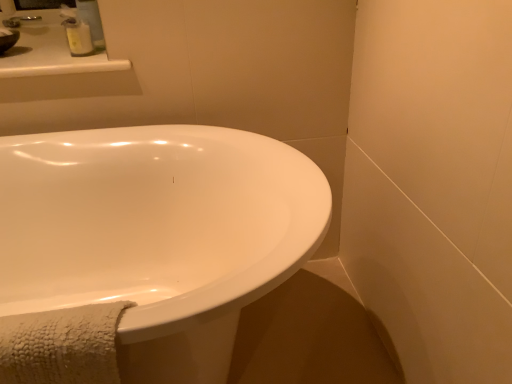
Measure the distance between white glossy bathtub at lower left and camera.

The depth of white glossy bathtub at lower left is 21.55 inches.

This screenshot has height=384, width=512. Describe the element at coordinates (78, 37) in the screenshot. I see `white plastic soap dispenser at upper left` at that location.

The image size is (512, 384). I want to click on matte white sink at upper left, so click(x=9, y=33).

From a real-world perspective, is white glossy bathtub at lower left positioned above or below white plastic soap dispenser at upper left?

Clearly, from a real-world perspective, white glossy bathtub at lower left is below white plastic soap dispenser at upper left.

From the image's perspective, is white glossy bathtub at lower left positioned above or below white plastic soap dispenser at upper left?

white glossy bathtub at lower left is below white plastic soap dispenser at upper left.

Which is more to the left, white glossy bathtub at lower left or white plastic soap dispenser at upper left?

From the viewer's perspective, white plastic soap dispenser at upper left appears more on the left side.

Is white plastic soap dispenser at upper left completely or partially inside white glossy bathtub at lower left?

No, white plastic soap dispenser at upper left is located outside of white glossy bathtub at lower left.

From the image's perspective, is white plastic soap dispenser at upper left below matte white sink at upper left?

Actually, white plastic soap dispenser at upper left appears above matte white sink at upper left in the image.

Would you say white plastic soap dispenser at upper left is outside matte white sink at upper left?

white plastic soap dispenser at upper left lies outside matte white sink at upper left's area.

Considering the sizes of objects white plastic soap dispenser at upper left and matte white sink at upper left in the image provided, who is thinner, white plastic soap dispenser at upper left or matte white sink at upper left?

Thinner between the two is white plastic soap dispenser at upper left.

From the picture: Who is shorter, white glossy bathtub at lower left or matte white sink at upper left?

matte white sink at upper left.

Is white glossy bathtub at lower left far away from matte white sink at upper left?

No.

From a real-world perspective, is white glossy bathtub at lower left on matte white sink at upper left?

Actually, white glossy bathtub at lower left is physically below matte white sink at upper left in the real world.

How far apart are white glossy bathtub at lower left and matte white sink at upper left?

The distance of white glossy bathtub at lower left from matte white sink at upper left is 79.81 centimeters.

From the image's perspective, which one is positioned higher, matte white sink at upper left or white glossy bathtub at lower left?

matte white sink at upper left appears higher in the image.

Could white glossy bathtub at lower left be considered to be inside matte white sink at upper left?

Actually, white glossy bathtub at lower left is outside matte white sink at upper left.

Is matte white sink at upper left at the right side of white glossy bathtub at lower left?

In fact, matte white sink at upper left is to the left of white glossy bathtub at lower left.

Considering the sizes of objects matte white sink at upper left and white glossy bathtub at lower left in the image provided, who is thinner, matte white sink at upper left or white glossy bathtub at lower left?

Thinner between the two is matte white sink at upper left.

Can you confirm if white plastic soap dispenser at upper left is smaller than white glossy bathtub at lower left?

Yes, white plastic soap dispenser at upper left is smaller than white glossy bathtub at lower left.

Where is `soap dispenser behind the white glossy bathtub at lower left`? Image resolution: width=512 pixels, height=384 pixels. soap dispenser behind the white glossy bathtub at lower left is located at coordinates (78, 37).

Is white glossy bathtub at lower left located within white plastic soap dispenser at upper left?

No, white glossy bathtub at lower left is not inside white plastic soap dispenser at upper left.

From a real-world perspective, is white plastic soap dispenser at upper left physically below white glossy bathtub at lower left?

Incorrect, from a real-world perspective, white plastic soap dispenser at upper left is higher than white glossy bathtub at lower left.

What's the angular difference between matte white sink at upper left and white plastic soap dispenser at upper left's facing directions?

matte white sink at upper left and white plastic soap dispenser at upper left are facing 6.94 degrees away from each other.

From the image's perspective, is matte white sink at upper left positioned above or below white plastic soap dispenser at upper left?

matte white sink at upper left is below white plastic soap dispenser at upper left.

Considering the points (17, 20) and (77, 52), which point is in front, point (17, 20) or point (77, 52)?

Positioned in front is point (77, 52).

Would you consider matte white sink at upper left to be distant from white plastic soap dispenser at upper left?

They are positioned close to each other.

You are a GUI agent. You are given a task and a screenshot of the screen. Output one action in this format:
    pyautogui.click(x=<x>, y=<y>)
    Task: Click on the bathtub in front of the white plastic soap dispenser at upper left
    The height and width of the screenshot is (384, 512).
    Given the screenshot: What is the action you would take?
    pyautogui.click(x=157, y=234)

This screenshot has height=384, width=512. I want to click on soap dispenser above the matte white sink at upper left (from the image's perspective), so click(78, 37).

Based on their spatial positions, is white plastic soap dispenser at upper left or white glossy bathtub at lower left closer to matte white sink at upper left?

Among the two, white plastic soap dispenser at upper left is located nearer to matte white sink at upper left.

From the image, which object appears to be farther from white plastic soap dispenser at upper left, white glossy bathtub at lower left or matte white sink at upper left?

white glossy bathtub at lower left lies further to white plastic soap dispenser at upper left than the other object.

Which object lies nearer to the anchor point white plastic soap dispenser at upper left, matte white sink at upper left or white glossy bathtub at lower left?

Among the two, matte white sink at upper left is located nearer to white plastic soap dispenser at upper left.

Based on their spatial positions, is white glossy bathtub at lower left or white plastic soap dispenser at upper left further from matte white sink at upper left?

The object further to matte white sink at upper left is white glossy bathtub at lower left.

Consider the image. Looking at the image, which one is located closer to white glossy bathtub at lower left, matte white sink at upper left or white plastic soap dispenser at upper left?

white plastic soap dispenser at upper left lies closer to white glossy bathtub at lower left than the other object.

When comparing their distances from white glossy bathtub at lower left, does white plastic soap dispenser at upper left or matte white sink at upper left seem further?

matte white sink at upper left is further to white glossy bathtub at lower left.

Locate an element on the screen. This screenshot has width=512, height=384. sink between white glossy bathtub at lower left and white plastic soap dispenser at upper left in the front-back direction is located at coordinates (9, 33).